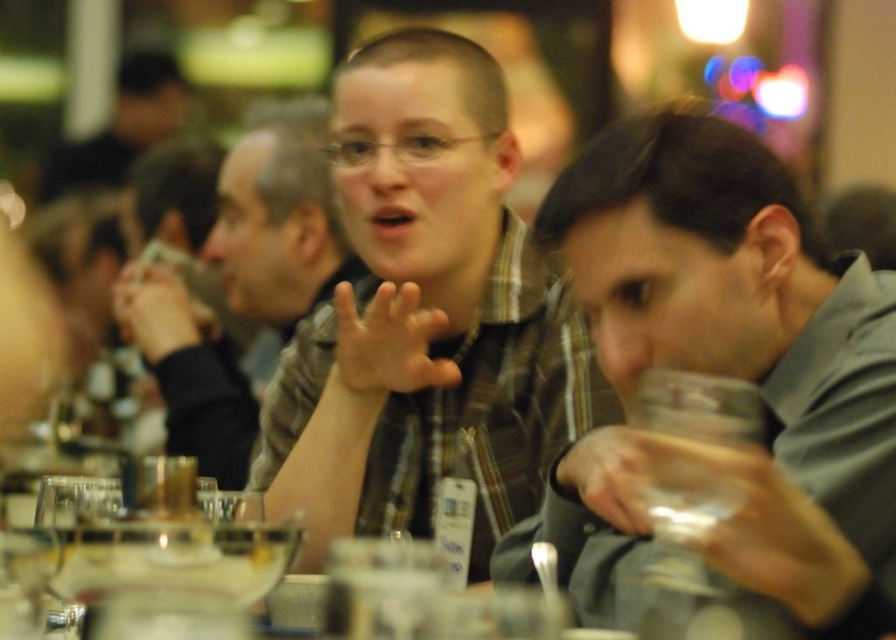
Question: Among these objects, which one is nearest to the camera?

Choices:
 (A) plaid shirt at center
 (B) transparent plastic wine glass at right
 (C) matte plaid shirt at center

Answer: (B)

Question: Which point is farther to the camera?

Choices:
 (A) (520, 404)
 (B) (162, 307)
 (C) (614, 598)
 (D) (739, 500)

Answer: (B)

Question: Estimate the real-world distances between objects in this image. Which object is closer to the plaid shirt at center?

Choices:
 (A) gray matte glass at right
 (B) matte plaid shirt at center

Answer: (B)

Question: Does plaid shirt at center have a smaller size compared to transparent plastic wine glass at right?

Choices:
 (A) yes
 (B) no

Answer: (B)

Question: Can you confirm if gray matte glass at right is bigger than plaid shirt at center?

Choices:
 (A) no
 (B) yes

Answer: (A)

Question: Is plaid shirt at center thinner than transparent plastic wine glass at right?

Choices:
 (A) yes
 (B) no

Answer: (B)